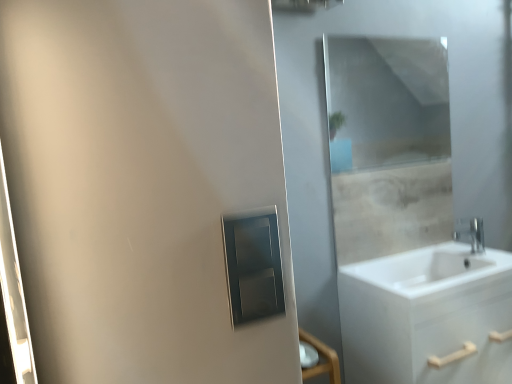
The width and height of the screenshot is (512, 384). Identify the location of free space to the back side of silver metallic faucet at right. (452, 246).